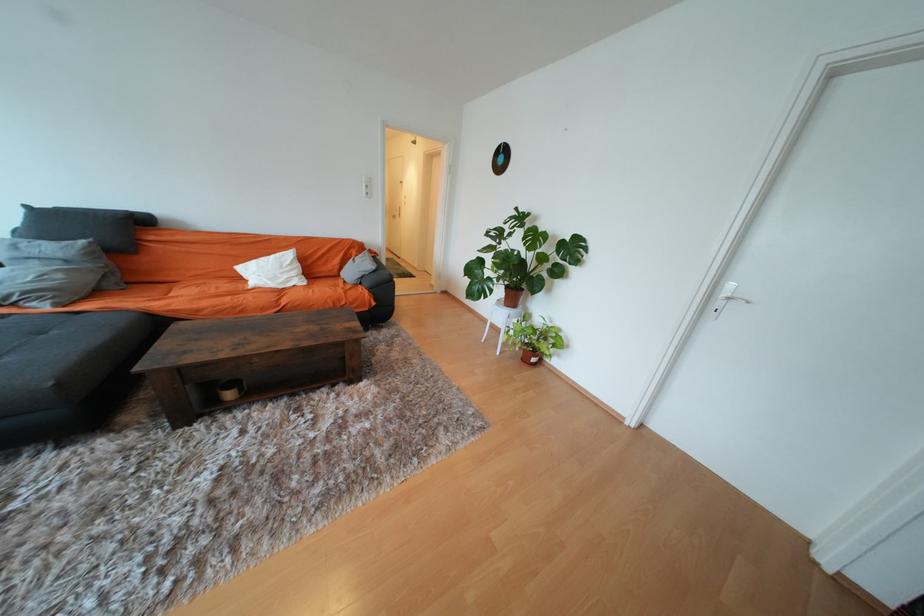
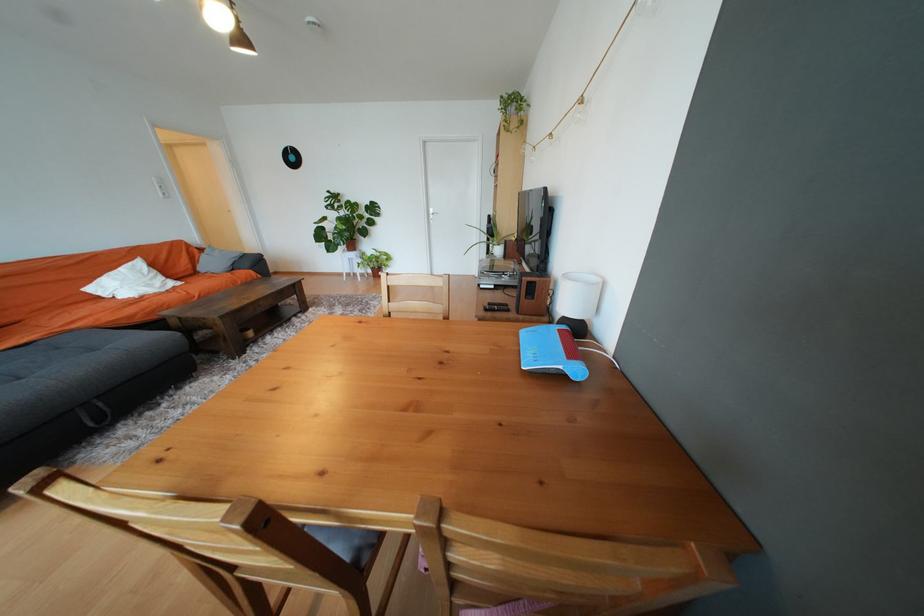
Question: I am providing you with two images of the same scene from different viewpoints. After the viewpoint changes to image2, which objects are now occluded?

Choices:
 (A) white door handle
 (B) white table lamp
 (C) wooden speaker
 (D) none of these

Answer: (D)